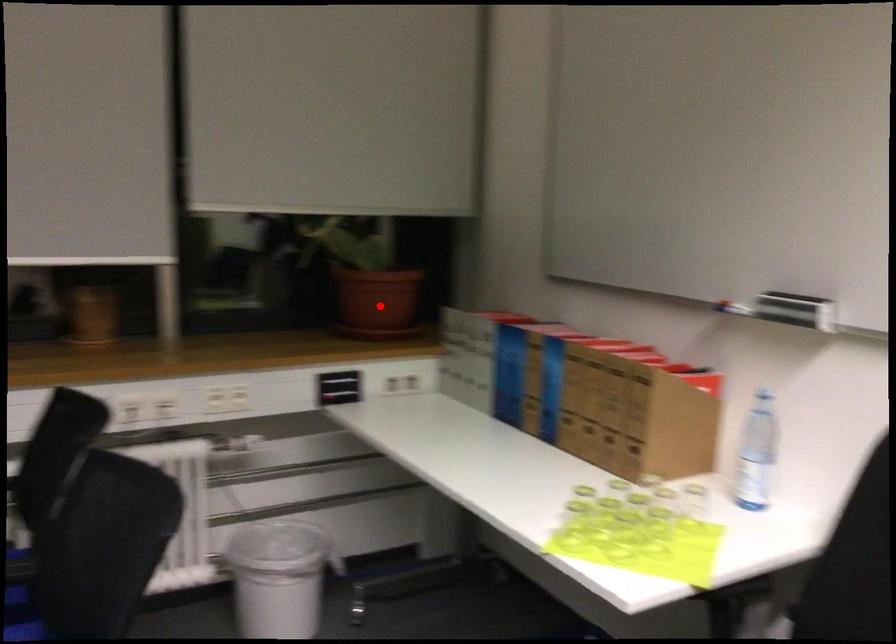
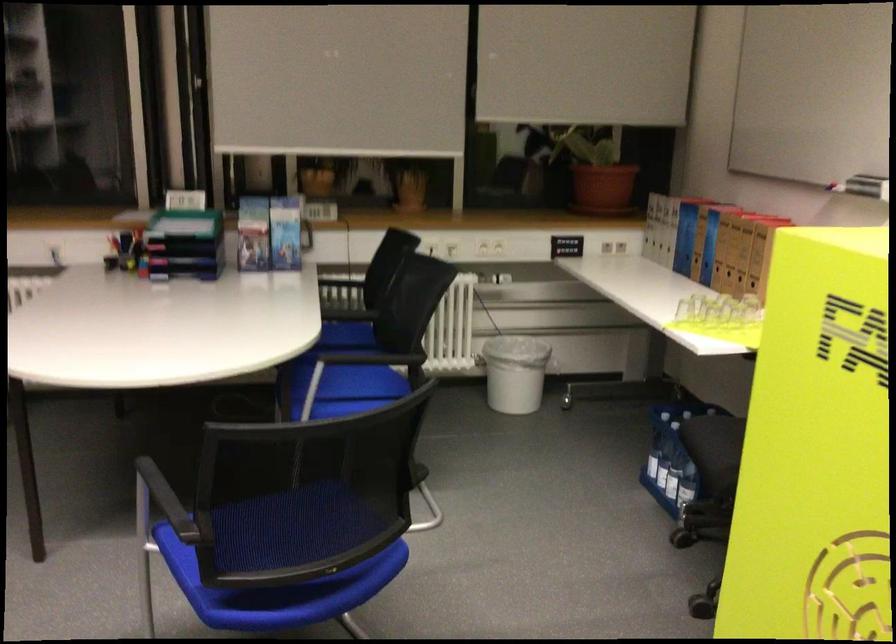
Find the pixel in the second image that matches the highlighted location in the first image.

(602, 187)